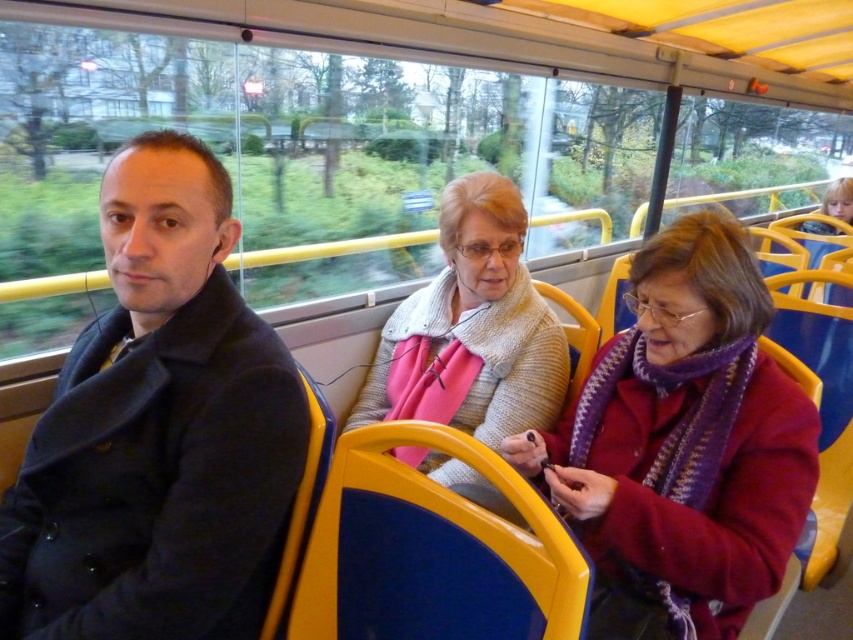
Question: Can you confirm if matte black coat at left is positioned to the left of knitted purple scarf at center?

Choices:
 (A) no
 (B) yes

Answer: (B)

Question: Estimate the real-world distances between objects in this image. Which object is closer to the matte black coat at left?

Choices:
 (A) knitted sweater at center
 (B) knitted purple scarf at center

Answer: (B)

Question: Which of these objects is positioned closest to the knitted purple scarf at center?

Choices:
 (A) knitted sweater at center
 (B) matte black coat at left

Answer: (A)

Question: Does matte black coat at left lie in front of knitted sweater at center?

Choices:
 (A) no
 (B) yes

Answer: (B)

Question: Is matte black coat at left below knitted sweater at center?

Choices:
 (A) no
 (B) yes

Answer: (B)

Question: Which object is the closest to the knitted sweater at center?

Choices:
 (A) matte black coat at left
 (B) knitted purple scarf at center

Answer: (B)